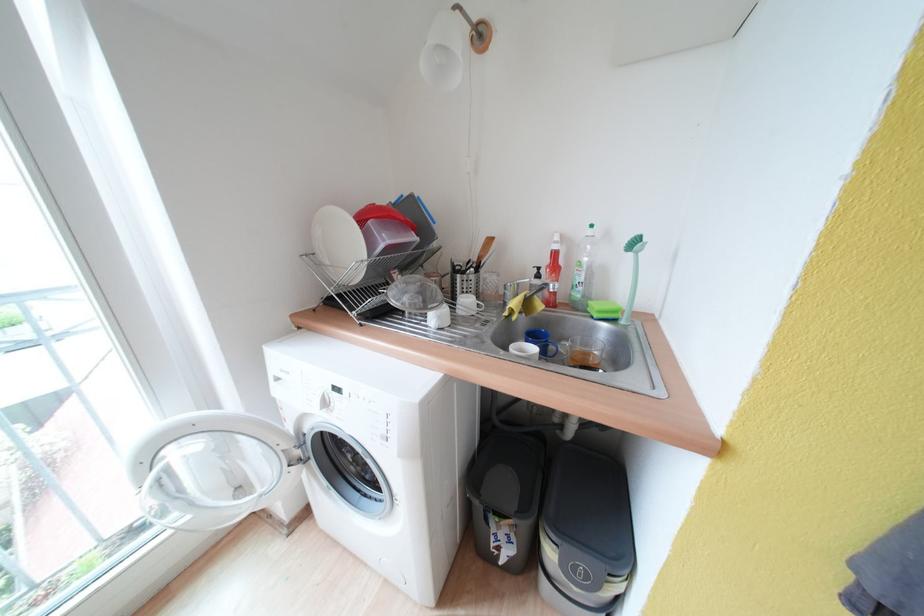
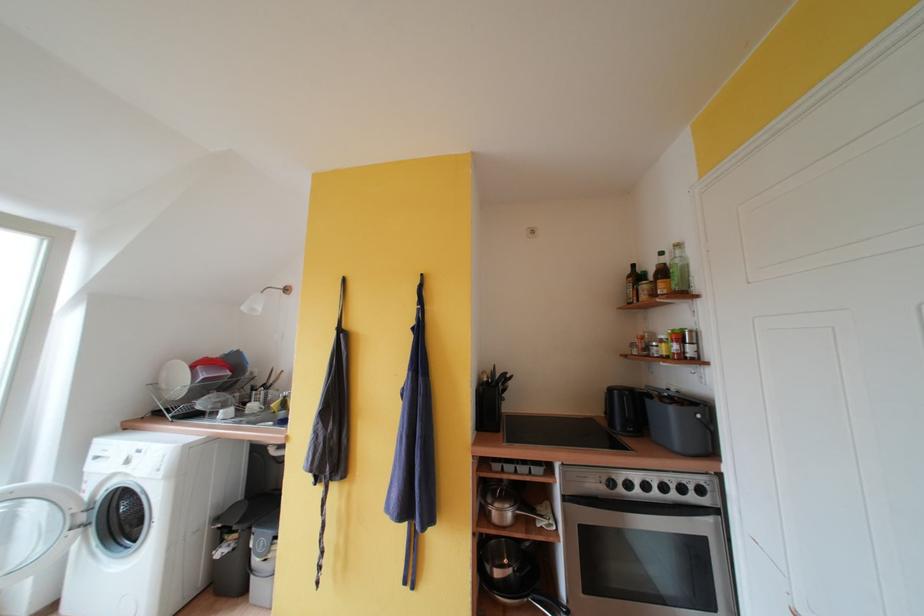
Where in the second image is the point corresponding to (282,444) from the first image?

(76, 509)